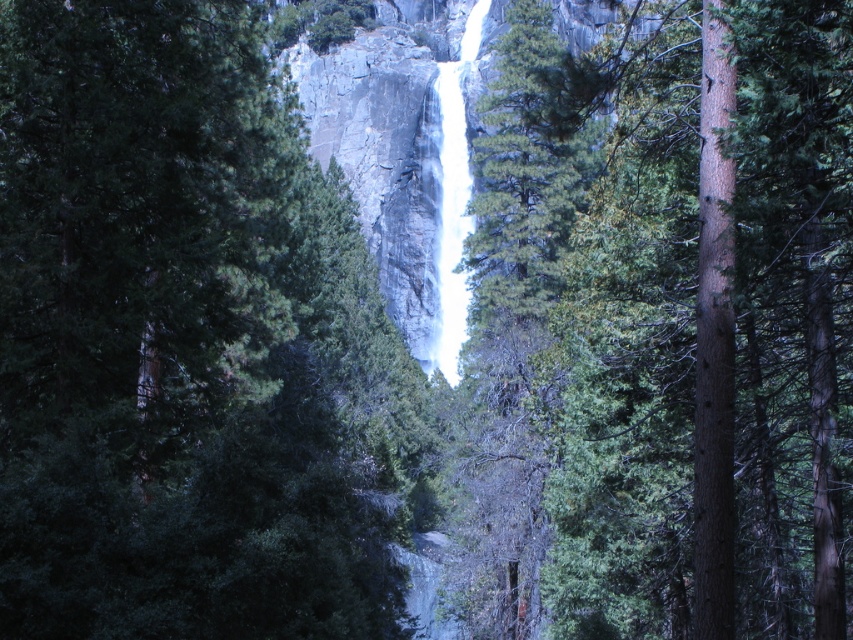
Is green matte tree at center to the left of green rough bark tree at center from the viewer's perspective?

Correct, you'll find green matte tree at center to the left of green rough bark tree at center.

Which of these two, green matte tree at center or green rough bark tree at center, stands shorter?

green matte tree at center is shorter.

Where is `green matte tree at center`? green matte tree at center is located at coordinates (186, 342).